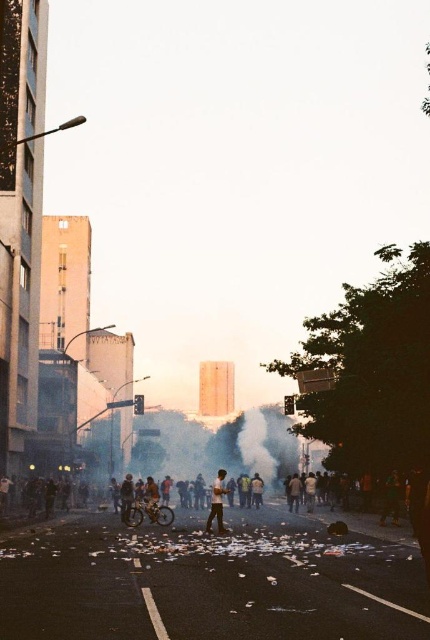
Does white fog at center have a lesser height compared to light brown leather jacket at center?

No.

Find the location of a particular element. The image size is (430, 640). white fog at center is located at coordinates tap(221, 445).